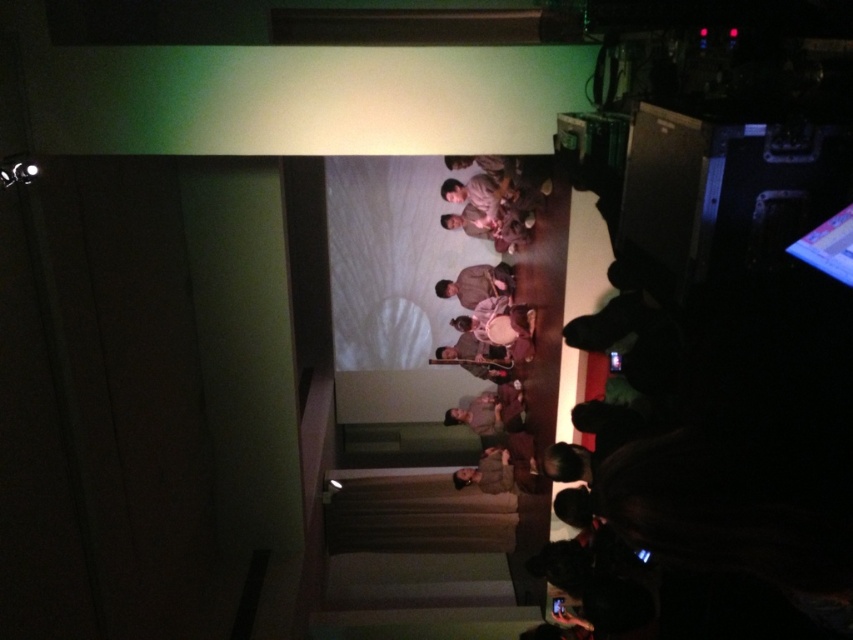
Question: Is brown fabric at center closer to camera compared to brown fabric shirt at center?

Choices:
 (A) no
 (B) yes

Answer: (B)

Question: Which of the following is the farthest from the observer?

Choices:
 (A) brown fabric shirt at center
 (B) brown fabric at center

Answer: (A)

Question: Does brown fabric at center come in front of brown fabric shirt at center?

Choices:
 (A) yes
 (B) no

Answer: (A)

Question: Does brown fabric at center appear under brown fabric shirt at center?

Choices:
 (A) yes
 (B) no

Answer: (A)

Question: Which point is farther to the camera?

Choices:
 (A) (517, 406)
 (B) (489, 280)

Answer: (B)